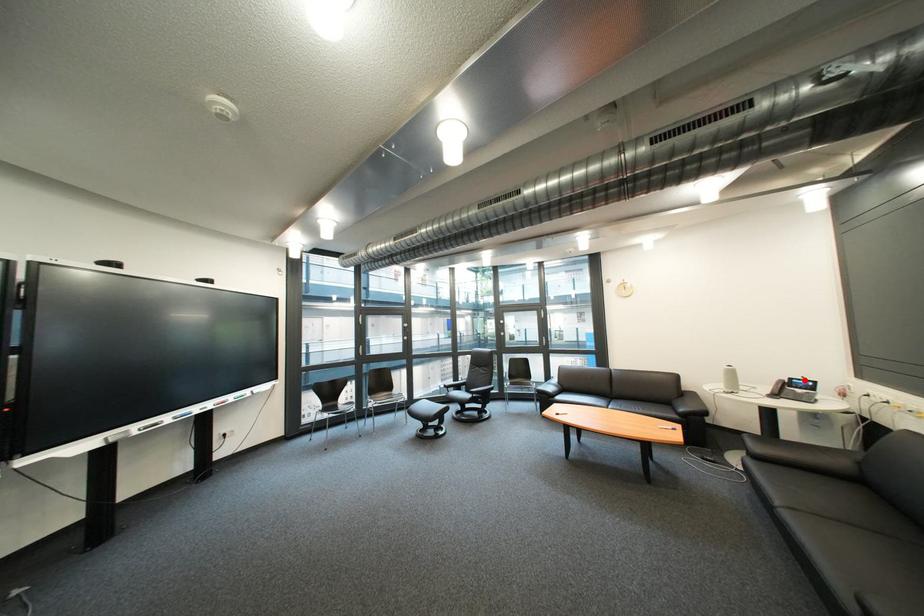
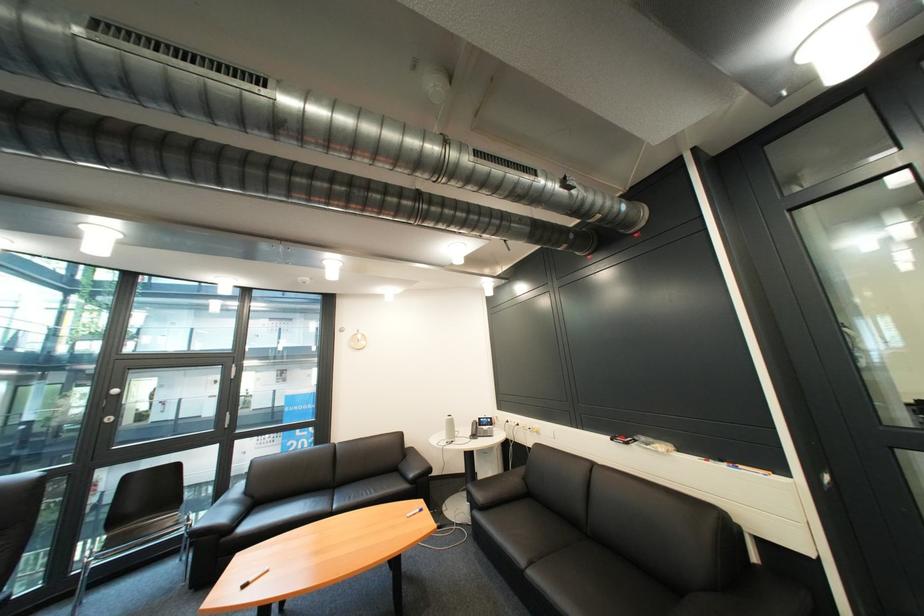
In the second image, find the point that corresponds to the highlighted location in the first image.

(492, 419)